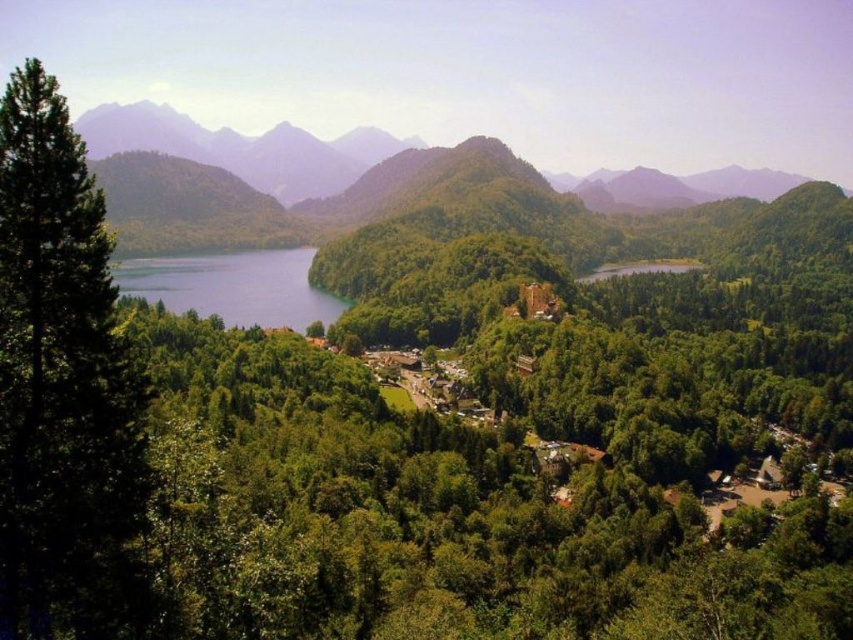
In the scene shown: Is green textured tree at left below blue water at center left?

Yes, green textured tree at left is below blue water at center left.

Is point (32, 593) more distant than point (164, 269)?

No, (32, 593) is closer to viewer.

Does point (44, 627) come closer to viewer compared to point (247, 280)?

Yes, point (44, 627) is closer to viewer.

Locate an element on the screen. green textured tree at left is located at coordinates (62, 388).